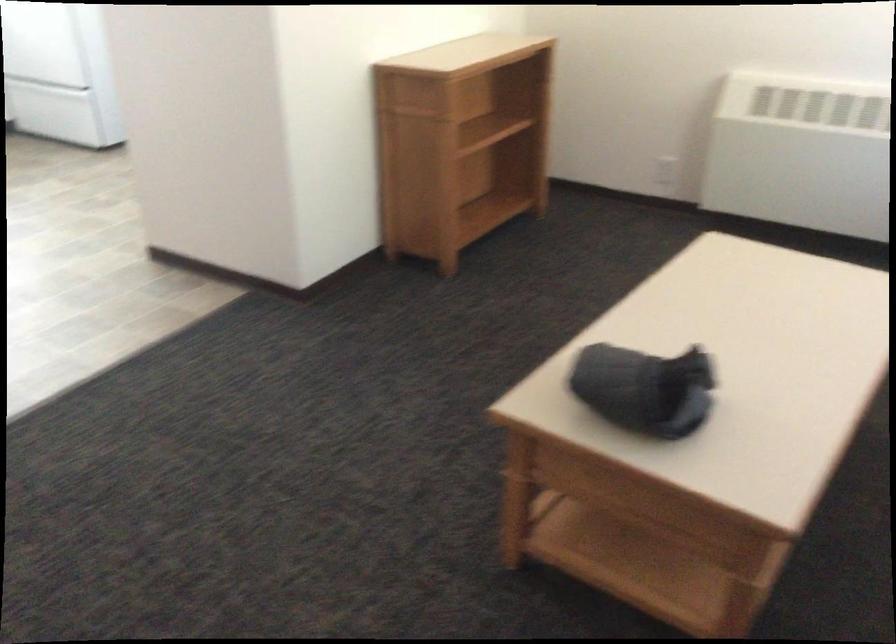
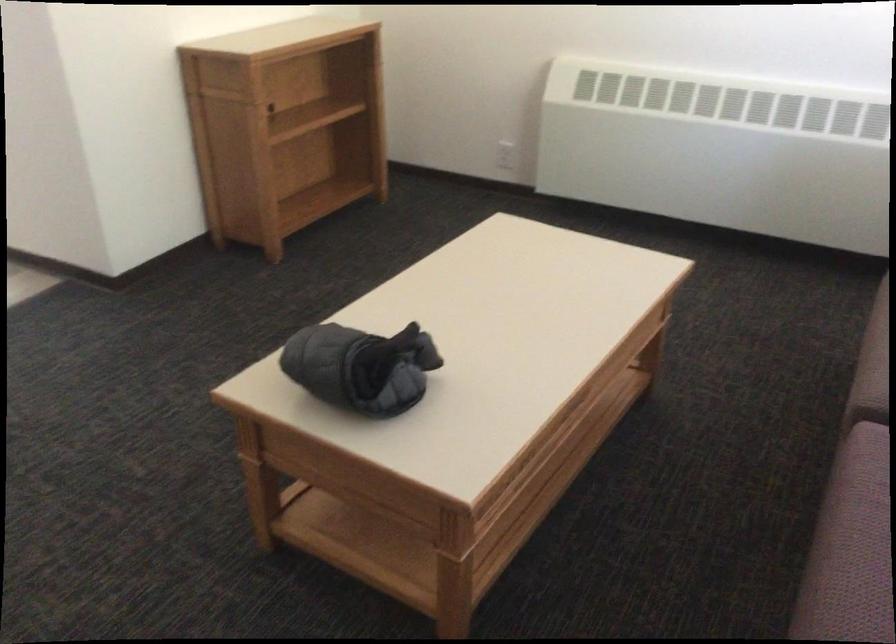
Question: The first image is from the beginning of the video and the second image is from the end. How did the camera likely rotate when shooting the video?

Choices:
 (A) Left
 (B) Right
 (C) Up
 (D) Down

Answer: (B)